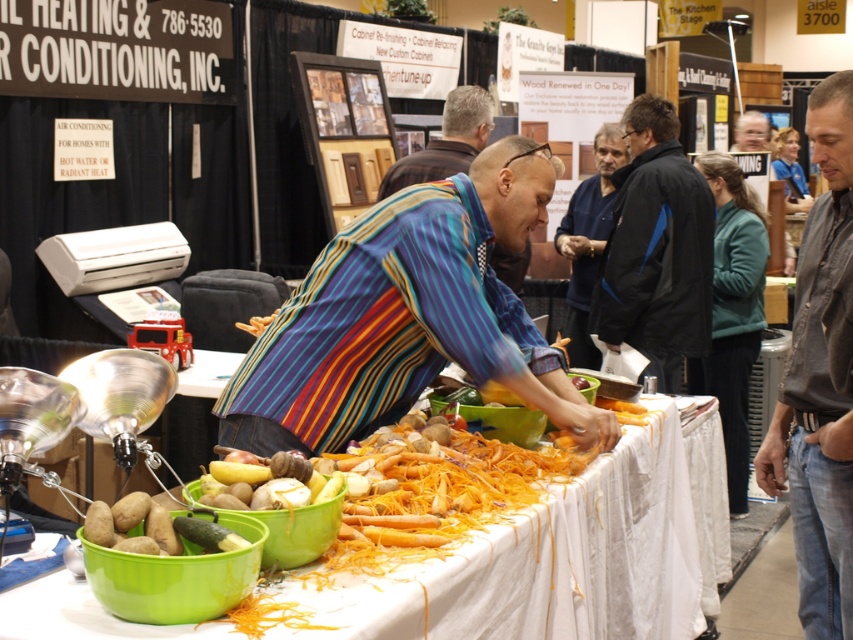
Looking at this image, is the position of orange shredded carrots at center more distant than that of striped shirt at center?

That is False.

Is orange shredded carrots at center below striped shirt at center?

Correct, orange shredded carrots at center is located below striped shirt at center.

The width and height of the screenshot is (853, 640). Describe the element at coordinates (567, 554) in the screenshot. I see `orange shredded carrots at center` at that location.

You are a GUI agent. You are given a task and a screenshot of the screen. Output one action in this format:
    pyautogui.click(x=<x>, y=<y>)
    Task: Click on the orange shredded carrots at center
    The width and height of the screenshot is (853, 640).
    Given the screenshot: What is the action you would take?
    pyautogui.click(x=567, y=554)

Which is below, dark blue sweater at center or striped shirt at center?

dark blue sweater at center is lower down.

Can you confirm if dark blue sweater at center is thinner than striped shirt at center?

Indeed, dark blue sweater at center has a lesser width compared to striped shirt at center.

What are the coordinates of `dark blue sweater at center` in the screenshot? It's located at (589, 241).

Which is above, brown leather jacket at lower right or striped shirt at center?

striped shirt at center is higher up.

Is brown leather jacket at lower right wider than striped shirt at center?

No.

Does point (831, 172) lie in front of point (386, 186)?

That is True.

Locate an element on the screen. This screenshot has width=853, height=640. brown leather jacket at lower right is located at coordinates (820, 380).